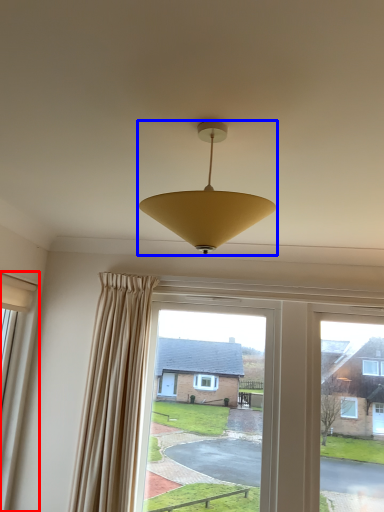
Question: Which object is closer to the camera taking this photo, window (highlighted by a red box) or lamp (highlighted by a blue box)?

Choices:
 (A) window
 (B) lamp

Answer: (B)